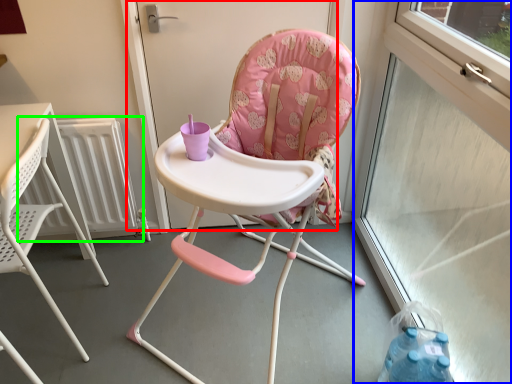
Question: Considering the real-world distances, which object is farthest from screen door (highlighted by a red box)? window screen (highlighted by a blue box) or radiator (highlighted by a green box)?

Choices:
 (A) window screen
 (B) radiator

Answer: (A)